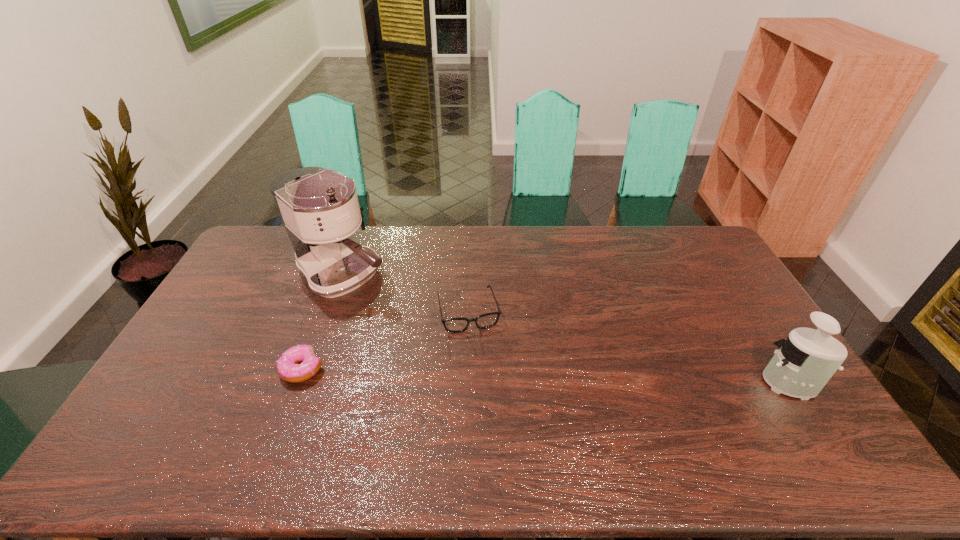
You are a GUI agent. You are given a task and a screenshot of the screen. Output one action in this format:
    pyautogui.click(x=<x>, y=<y>)
    Task: Click on the free space between the spectacles and the doughnut
    Image resolution: width=960 pixels, height=540 pixels.
    Given the screenshot: What is the action you would take?
    pyautogui.click(x=385, y=340)

In order to click on free space between the spectacles and the rightmost object in this screenshot , I will do `click(627, 346)`.

Find the location of a particular element. This screenshot has height=540, width=960. object that stands as the closest to the doughnut is located at coordinates (319, 208).

Select which object is the third closest to the third tallest object. Please provide its 2D coordinates. Your answer should be formatted as a tuple, i.e. [(x, y)], where the tuple contains the x and y coordinates of a point satisfying the conditions above.

[(804, 363)]

Locate an element on the screen. The width and height of the screenshot is (960, 540). vacant space that satisfies the following two spatial constraints: 1. on the front side of the third tallest object; 2. on the left side of the coffee maker is located at coordinates (331, 311).